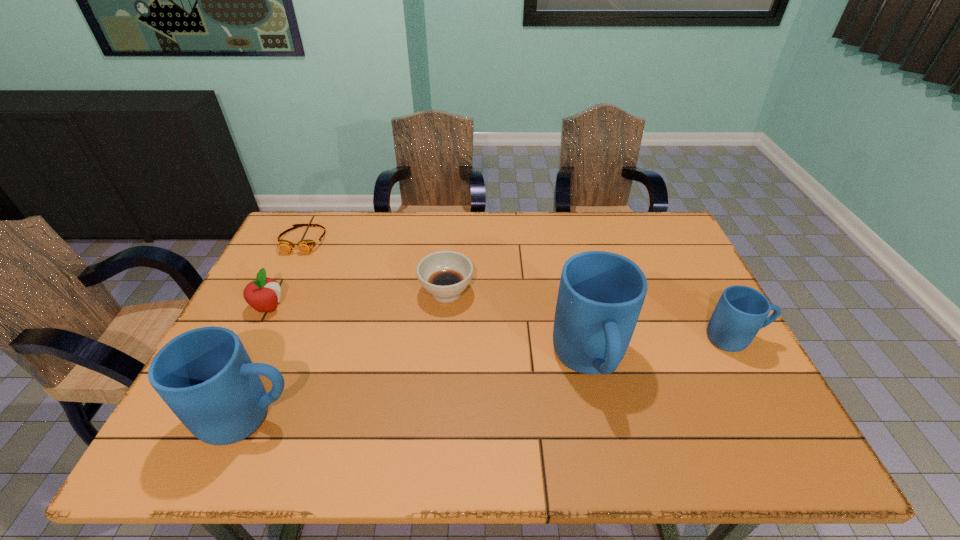
What are the coordinates of `free location located on the side of the second tallest object with the handle` in the screenshot? It's located at (468, 417).

Find the location of a particular element. The image size is (960, 540). free location located 0.280m on the left of the soup bowl is located at coordinates (323, 292).

Locate an element on the screen. free location located with the lenses facing forward on the goggles is located at coordinates (286, 276).

Locate an element on the screen. free region located 0.070m on the front of the fourth tallest object is located at coordinates (252, 339).

This screenshot has width=960, height=540. Find the location of `object positioned at the far edge`. object positioned at the far edge is located at coordinates (305, 246).

Find the location of a particular element. mug at the left edge is located at coordinates (205, 376).

The image size is (960, 540). I want to click on goggles that is at the left edge, so click(305, 246).

Where is `apple that is at the left edge`? The image size is (960, 540). apple that is at the left edge is located at coordinates (263, 294).

Locate an element on the screen. This screenshot has width=960, height=540. object located in the right edge section of the desktop is located at coordinates (741, 311).

At what (x,y) coordinates should I click in order to perform the action: click on object at the far left corner. Please return your answer as a coordinate pair (x, y). Looking at the image, I should click on (305, 246).